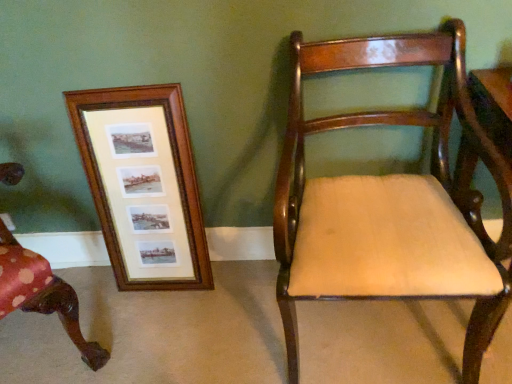
Measure the distance between wooden chair at left, which is counted as the second chair, starting from the right, and camera.

wooden chair at left, which is counted as the second chair, starting from the right, and camera are 1.05 meters apart.

The width and height of the screenshot is (512, 384). Find the location of `wooden frame at left`. wooden frame at left is located at coordinates (143, 185).

Locate an element on the screen. This screenshot has width=512, height=384. wooden chair at left, marked as the first chair in a left-to-right arrangement is located at coordinates (41, 294).

Is wooden chair at left, marked as the first chair in a left-to-right arrangement, located within mahogany wood chair at right, the 1th chair viewed from the right?

No, mahogany wood chair at right, the 1th chair viewed from the right, does not contain wooden chair at left, marked as the first chair in a left-to-right arrangement.

Is mahogany wood chair at right, which is the 2th chair from left to right, aimed at wooden chair at left, marked as the first chair in a left-to-right arrangement?

No, mahogany wood chair at right, which is the 2th chair from left to right, does not turn towards wooden chair at left, marked as the first chair in a left-to-right arrangement.

Is mahogany wood chair at right, the 1th chair viewed from the right, further to the viewer compared to wooden chair at left, marked as the first chair in a left-to-right arrangement?

That is False.

From the image's perspective, is wooden frame at left over wooden chair at left, which is counted as the second chair, starting from the right?

Correct, wooden frame at left appears higher than wooden chair at left, which is counted as the second chair, starting from the right, in the image.

Is wooden frame at left far from wooden chair at left, which is counted as the second chair, starting from the right?

That's not correct — wooden frame at left is a little close to wooden chair at left, which is counted as the second chair, starting from the right.

Visually, is wooden frame at left positioned to the left or to the right of wooden chair at left, which is counted as the second chair, starting from the right?

From the image, it's evident that wooden frame at left is to the right of wooden chair at left, which is counted as the second chair, starting from the right.

Consider the image. Is wooden chair at left, marked as the first chair in a left-to-right arrangement, surrounded by wooden frame at left?

No, wooden chair at left, marked as the first chair in a left-to-right arrangement, is not surrounded by wooden frame at left.

Which is behind, point (45, 306) or point (84, 92)?

The point (84, 92) is farther from the camera.

Which is correct: wooden chair at left, which is counted as the second chair, starting from the right, is inside wooden frame at left, or outside of it?

The correct answer is: outside.

Based on the photo, considering the sizes of wooden chair at left, which is counted as the second chair, starting from the right, and wooden frame at left in the image, is wooden chair at left, which is counted as the second chair, starting from the right, bigger or smaller than wooden frame at left?

Considering their sizes, wooden chair at left, which is counted as the second chair, starting from the right, takes up more space than wooden frame at left.

Does wooden frame at left turn towards mahogany wood chair at right, the 1th chair viewed from the right?

No, wooden frame at left is not oriented towards mahogany wood chair at right, the 1th chair viewed from the right.

Between wooden frame at left and mahogany wood chair at right, the 1th chair viewed from the right, which one appears on the left side from the viewer's perspective?

Positioned to the left is wooden frame at left.

Is point (151, 257) closer to viewer compared to point (412, 115)?

No.

From the image's perspective, is wooden frame at left located above mahogany wood chair at right, which is the 2th chair from left to right?

Yes, from the image's perspective, wooden frame at left is over mahogany wood chair at right, which is the 2th chair from left to right.

Which of these two, mahogany wood chair at right, the 1th chair viewed from the right, or wooden frame at left, stands taller?

mahogany wood chair at right, the 1th chair viewed from the right.

Based on the photo, which object is positioned more to the left, mahogany wood chair at right, which is the 2th chair from left to right, or wooden frame at left?

wooden frame at left is more to the left.

Is mahogany wood chair at right, which is the 2th chair from left to right, thinner than wooden frame at left?

In fact, mahogany wood chair at right, which is the 2th chair from left to right, might be wider than wooden frame at left.

Consider the image. From the image's perspective, between mahogany wood chair at right, the 1th chair viewed from the right, and wooden frame at left, who is located below?

mahogany wood chair at right, the 1th chair viewed from the right.

Which point is more forward, (6, 310) or (509, 182)?

Point (509, 182)

From the image's perspective, relative to mahogany wood chair at right, the 1th chair viewed from the right, is wooden chair at left, marked as the first chair in a left-to-right arrangement, above or below?

Based on their image positions, wooden chair at left, marked as the first chair in a left-to-right arrangement, is located beneath mahogany wood chair at right, the 1th chair viewed from the right.

Based on their positions, is wooden chair at left, which is counted as the second chair, starting from the right, located to the left or right of mahogany wood chair at right, which is the 2th chair from left to right?

In the image, wooden chair at left, which is counted as the second chair, starting from the right, appears on the left side of mahogany wood chair at right, which is the 2th chair from left to right.

The image size is (512, 384). I want to click on chair to the right of wooden chair at left, marked as the first chair in a left-to-right arrangement, so click(391, 202).

I want to click on the 2nd chair directly above the wooden frame at left (from a real-world perspective), so click(x=41, y=294).

Based on their spatial positions, is wooden chair at left, marked as the first chair in a left-to-right arrangement, or wooden frame at left closer to mahogany wood chair at right, the 1th chair viewed from the right?

wooden frame at left is positioned closer to the anchor mahogany wood chair at right, the 1th chair viewed from the right.

Which object lies further to the anchor point mahogany wood chair at right, the 1th chair viewed from the right, wooden frame at left or wooden chair at left, which is counted as the second chair, starting from the right?

wooden chair at left, which is counted as the second chair, starting from the right.

Which object lies further to the anchor point wooden chair at left, marked as the first chair in a left-to-right arrangement, mahogany wood chair at right, which is the 2th chair from left to right, or wooden frame at left?

Among the two, mahogany wood chair at right, which is the 2th chair from left to right, is located further to wooden chair at left, marked as the first chair in a left-to-right arrangement.

When comparing their distances from wooden frame at left, does wooden chair at left, which is counted as the second chair, starting from the right, or mahogany wood chair at right, which is the 2th chair from left to right, seem closer?

wooden chair at left, which is counted as the second chair, starting from the right, lies closer to wooden frame at left than the other object.

Based on their spatial positions, is wooden frame at left or mahogany wood chair at right, which is the 2th chair from left to right, closer to wooden chair at left, marked as the first chair in a left-to-right arrangement?

The object closer to wooden chair at left, marked as the first chair in a left-to-right arrangement, is wooden frame at left.

When comparing their distances from wooden frame at left, does mahogany wood chair at right, which is the 2th chair from left to right, or wooden chair at left, marked as the first chair in a left-to-right arrangement, seem further?

mahogany wood chair at right, which is the 2th chair from left to right, lies further to wooden frame at left than the other object.

This screenshot has height=384, width=512. Find the location of `picture frame located between wooden chair at left, which is counted as the second chair, starting from the right, and mahogany wood chair at right, which is the 2th chair from left to right, in the left-right direction`. picture frame located between wooden chair at left, which is counted as the second chair, starting from the right, and mahogany wood chair at right, which is the 2th chair from left to right, in the left-right direction is located at coordinates (143, 185).